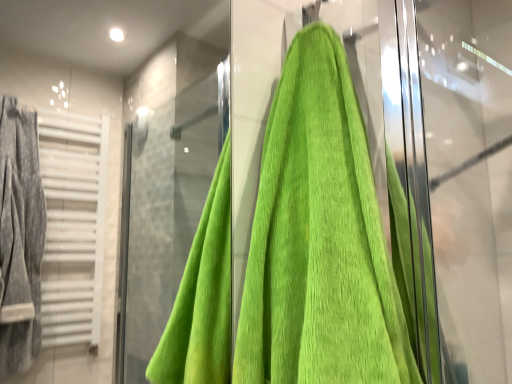
Question: Is green cotton towel at center spatially inside green towel at right, or outside of it?

Choices:
 (A) inside
 (B) outside

Answer: (B)

Question: Is green cotton towel at center in front of or behind green towel at right in the image?

Choices:
 (A) front
 (B) behind

Answer: (A)

Question: Visually, is green cotton towel at center positioned to the left or to the right of green towel at right?

Choices:
 (A) left
 (B) right

Answer: (A)

Question: Relative to green cotton towel at center, is green towel at right in front or behind?

Choices:
 (A) behind
 (B) front

Answer: (A)

Question: From a real-world perspective, is green towel at right positioned above or below green cotton towel at center?

Choices:
 (A) above
 (B) below

Answer: (A)

Question: Considering the positions of green towel at right and green cotton towel at center in the image, is green towel at right taller or shorter than green cotton towel at center?

Choices:
 (A) tall
 (B) short

Answer: (A)

Question: Does point (483, 137) appear closer or farther from the camera than point (275, 105)?

Choices:
 (A) closer
 (B) farther

Answer: (B)